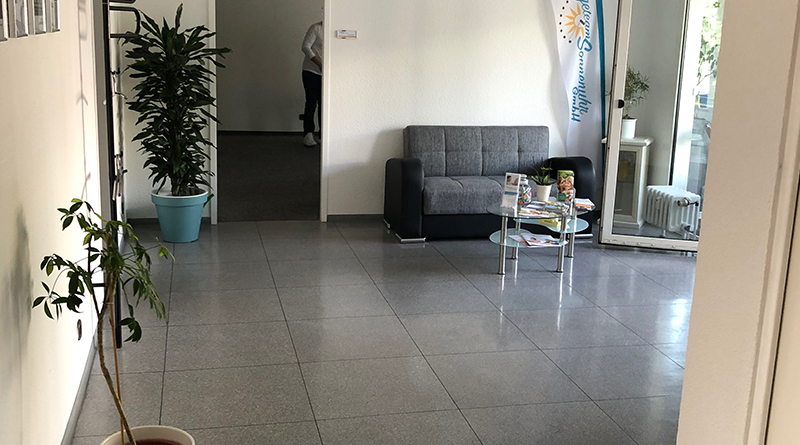
At what (x,y) coordinates should I click in order to perform the action: click on wall space behind couch. Please return your answer as a coordinate pair (x, y). The image size is (800, 445). Looking at the image, I should click on (472, 76).